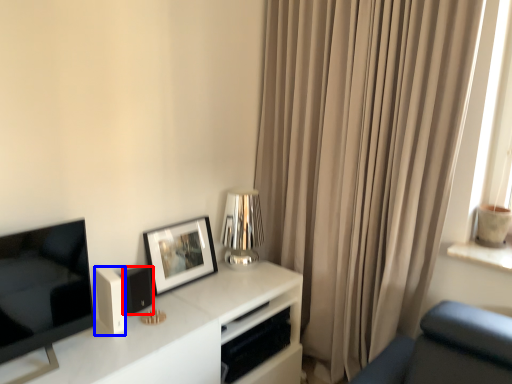
Question: Which object appears farthest to the camera in this image, speaker (highlighted by a red box) or appliance (highlighted by a blue box)?

Choices:
 (A) speaker
 (B) appliance

Answer: (A)